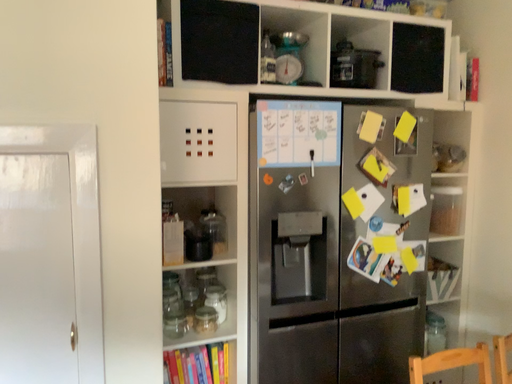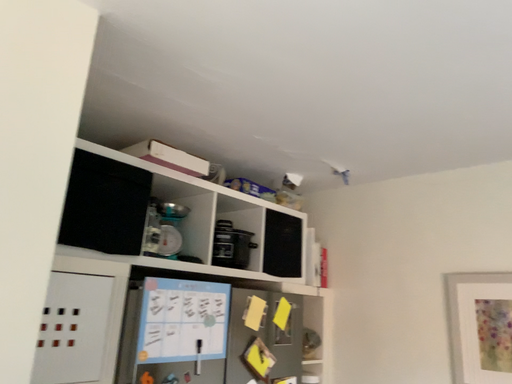
Question: Which way did the camera rotate in the video?

Choices:
 (A) rotated upward
 (B) rotated downward

Answer: (A)